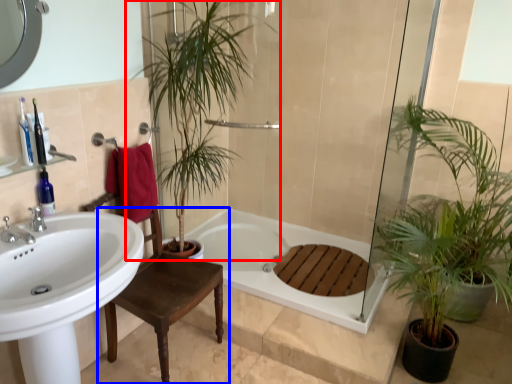
Question: Which object is closer to the camera taking this photo, houseplant (highlighted by a red box) or chair (highlighted by a blue box)?

Choices:
 (A) houseplant
 (B) chair

Answer: (B)